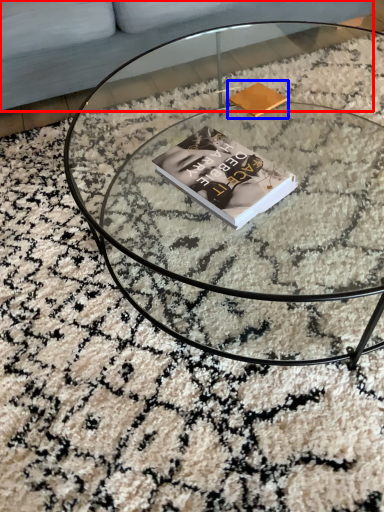
Question: Which point is closer to the camera, couch (highlighted by a red box) or paperback book (highlighted by a blue box)?

Choices:
 (A) couch
 (B) paperback book

Answer: (B)